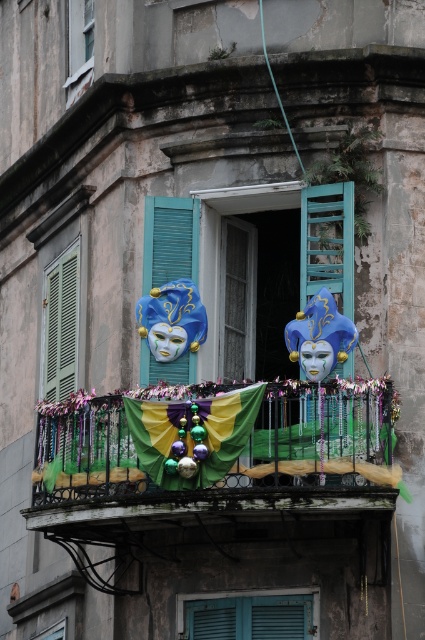
You are standing on the balcony and want to hang a new decoration. There is a point marked at coordinates [215,452]. What object is this point located on?

The point at coordinates [215,452] is located on the shiny metallic banner at center.

You are a window cleaner standing on the balcony. You need to clean the window behind the shiny metallic banner at center and the blue painted wood at center. Which object is closer to the window so you can reach it first?

The shiny metallic banner at center is much taller than the blue painted wood at center, so the blue painted wood at center is closer to the window and can be reached first.